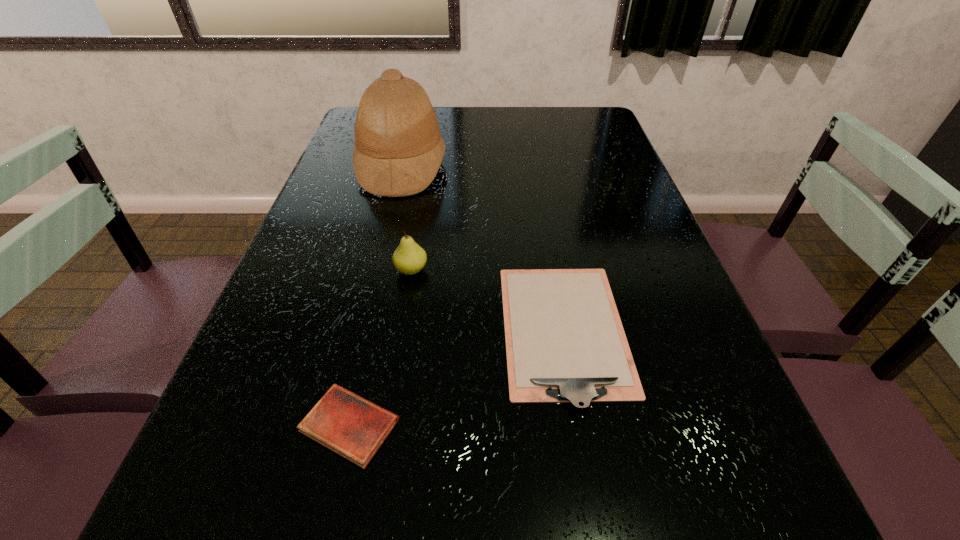
Find the location of a particular element. The image size is (960, 540). vacant space in between the diary and the second shortest object is located at coordinates (457, 379).

Image resolution: width=960 pixels, height=540 pixels. Identify the location of free spot between the diary and the tallest object. (375, 296).

Where is `free space between the shortest object and the rightmost object`? free space between the shortest object and the rightmost object is located at coordinates coord(457,379).

Where is `free space between the pear and the farthest object`? The image size is (960, 540). free space between the pear and the farthest object is located at coordinates (406, 218).

Find the location of a particular element. The image size is (960, 540). blank region between the tallest object and the pear is located at coordinates (406, 218).

Locate an element on the screen. This screenshot has width=960, height=540. unoccupied area between the clipboard and the diary is located at coordinates (457, 379).

Locate an element on the screen. This screenshot has height=540, width=960. blank region between the tallest object and the clipboard is located at coordinates (483, 249).

The height and width of the screenshot is (540, 960). I want to click on unoccupied area between the clipboard and the hat, so click(x=483, y=249).

Identify which object is the third nearest to the second tallest object. Please provide its 2D coordinates. Your answer should be formatted as a tuple, i.e. [(x, y)], where the tuple contains the x and y coordinates of a point satisfying the conditions above.

[(351, 426)]

The height and width of the screenshot is (540, 960). Identify the location of object that can be found as the closest to the pear. (565, 342).